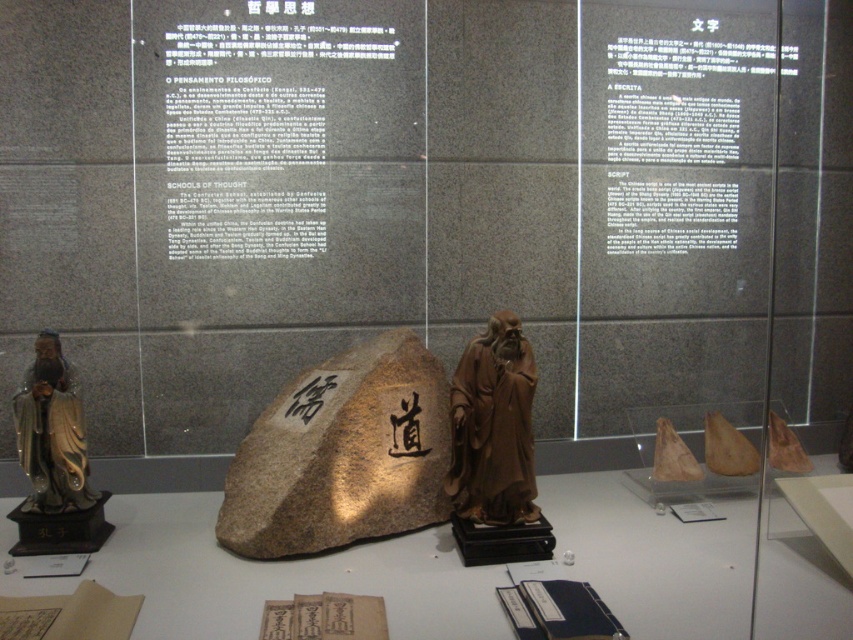
Question: Which is farther from the brown polished rock at center?

Choices:
 (A) brown wooden statue at center
 (B) gold lacquered statue at left

Answer: (B)

Question: Considering the real-world distances, which object is closest to the brown wooden statue at center?

Choices:
 (A) gold lacquered statue at left
 (B) brown polished rock at center

Answer: (B)

Question: Considering the relative positions of brown wooden statue at center and gold lacquered statue at left in the image provided, where is brown wooden statue at center located with respect to gold lacquered statue at left?

Choices:
 (A) right
 (B) left

Answer: (A)

Question: Which object appears closest to the camera in this image?

Choices:
 (A) gold lacquered statue at left
 (B) brown polished rock at center

Answer: (A)

Question: Can you confirm if brown polished rock at center is positioned to the left of gold lacquered statue at left?

Choices:
 (A) yes
 (B) no

Answer: (B)

Question: Does brown polished rock at center come in front of gold lacquered statue at left?

Choices:
 (A) yes
 (B) no

Answer: (B)